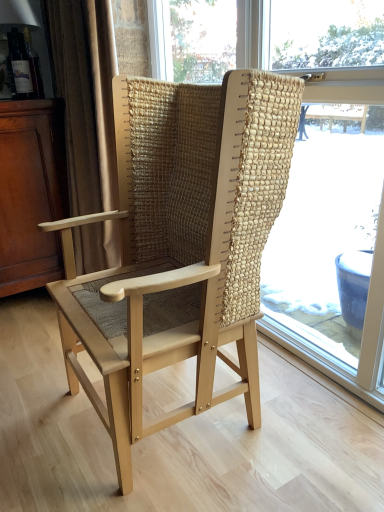
The image size is (384, 512). Identify the location of vacant area that is situated to the right of natural wood chair at center. (308, 419).